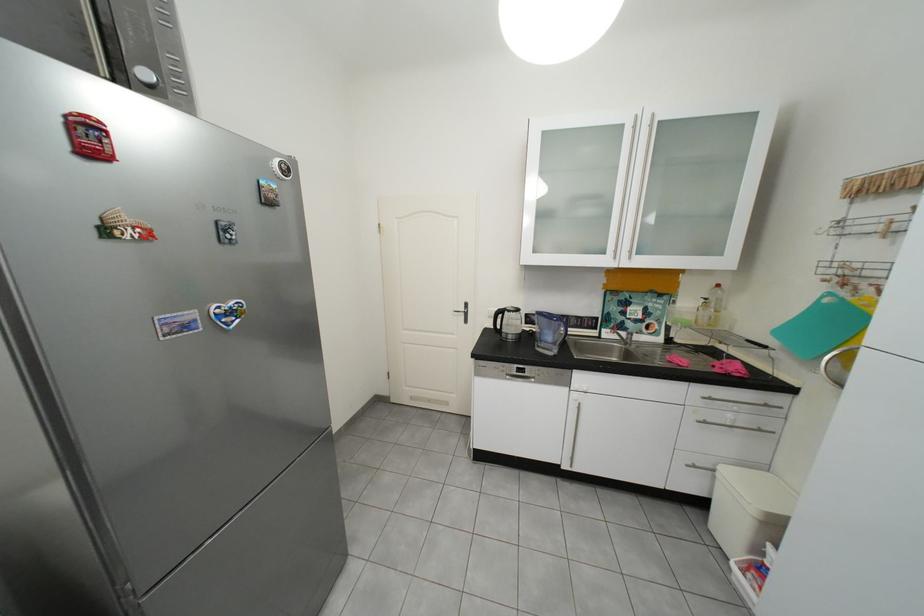
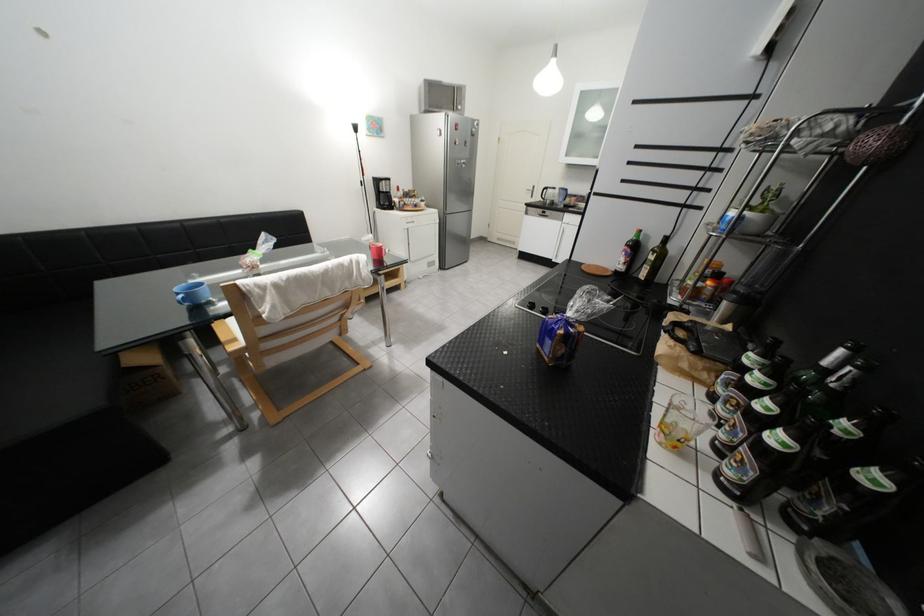
Find the pixel in the second image that matches [478,306] in the first image.

(545, 188)